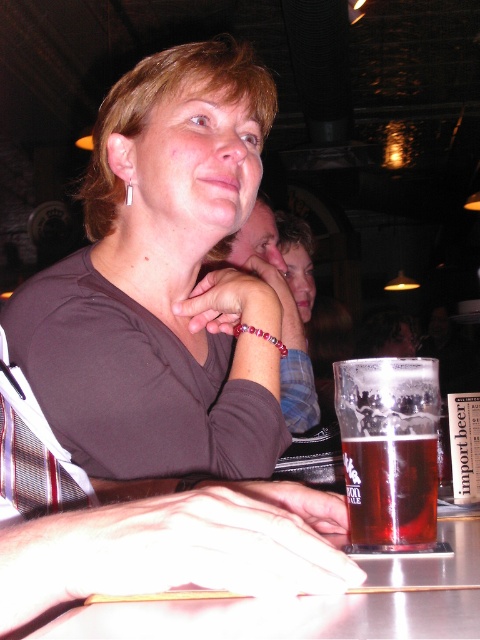
Question: Which point is farther from the camera taking this photo?

Choices:
 (A) (235, 172)
 (B) (261, 198)
 (C) (385, 536)

Answer: (B)

Question: In this image, where is matte brown shirt at center located relative to metallic silver table at lower center?

Choices:
 (A) below
 (B) above

Answer: (B)

Question: Considering the real-world distances, which object is farthest from the matte blue shirt at center?

Choices:
 (A) metallic silver table at lower center
 (B) matte brown shirt at center

Answer: (A)

Question: Which point appears closest to the camera in this image?

Choices:
 (A) (445, 634)
 (B) (116, 164)
 (C) (394, 465)

Answer: (A)

Question: Is matte brown shirt at center further to camera compared to metallic silver table at lower center?

Choices:
 (A) no
 (B) yes

Answer: (B)

Question: Does matte brown shirt at center come behind matte blue shirt at center?

Choices:
 (A) yes
 (B) no

Answer: (B)